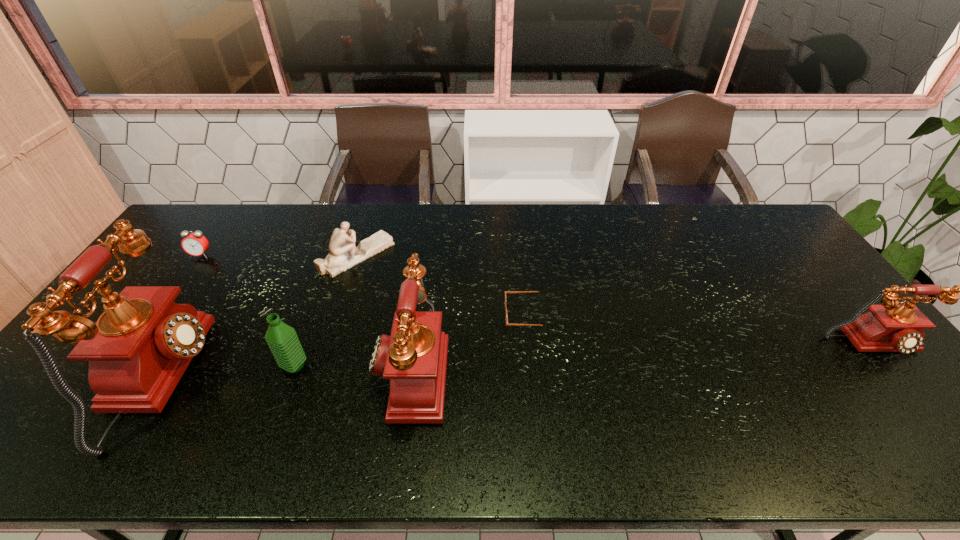
Where is `free space located 0.340m on the front-facing side of the sunglasses`? This screenshot has width=960, height=540. free space located 0.340m on the front-facing side of the sunglasses is located at coordinates (386, 315).

I want to click on object that is at the far edge, so click(343, 255).

Where is `object situated at the left edge`? Image resolution: width=960 pixels, height=540 pixels. object situated at the left edge is located at coordinates (195, 244).

Identify the location of object at the right edge. Image resolution: width=960 pixels, height=540 pixels. (889, 327).

At what (x,y) coordinates should I click in order to perform the action: click on vacant space at the far edge of the desktop. Please return your answer as a coordinate pair (x, y). Looking at the image, I should click on (394, 232).

Identify the location of free space at the near edge. (671, 392).

Locate an element on the screen. This screenshot has width=960, height=540. vacant space at the left edge of the desktop is located at coordinates (183, 264).

Locate an element on the screen. Image resolution: width=960 pixels, height=540 pixels. free point at the right edge is located at coordinates (878, 361).

At what (x,y) coordinates should I click in order to perform the action: click on free space at the far left corner of the desktop. Please return your answer as a coordinate pair (x, y). Looking at the image, I should click on (197, 208).

In the image, there is a desktop. Find the location of `vacant space at the near right corner`. vacant space at the near right corner is located at coordinates (888, 414).